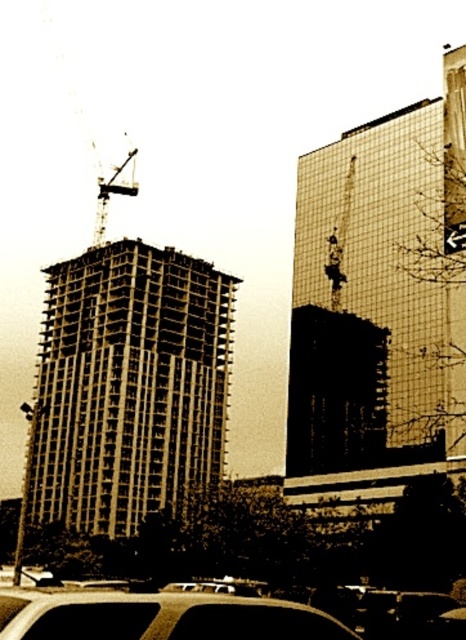
Who is positioned more to the right, reflective glass building at center or metallic construction crane at upper left?

From the viewer's perspective, reflective glass building at center appears more on the right side.

Can you confirm if reflective glass building at center is positioned to the left of metallic construction crane at upper left?

In fact, reflective glass building at center is to the right of metallic construction crane at upper left.

Is point (454, 188) more distant than point (98, 244)?

No, (454, 188) is in front of (98, 244).

Locate an element on the screen. reflective glass building at center is located at coordinates (379, 308).

Can you confirm if black glossy car at lower center is positioned below metallic construction crane at upper left?

Yes, black glossy car at lower center is below metallic construction crane at upper left.

Based on the photo, can you confirm if black glossy car at lower center is smaller than metallic construction crane at upper left?

Indeed, black glossy car at lower center has a smaller size compared to metallic construction crane at upper left.

Where is `black glossy car at lower center`? black glossy car at lower center is located at coordinates (160, 616).

Where is `black glossy car at lower center`? black glossy car at lower center is located at coordinates (160, 616).

Is reflective glass building at center positioned behind black glossy car at lower center?

That is True.

What are the coordinates of `reflective glass building at center` in the screenshot? It's located at (379, 308).

Locate an element on the screen. The width and height of the screenshot is (466, 640). reflective glass building at center is located at coordinates (379, 308).